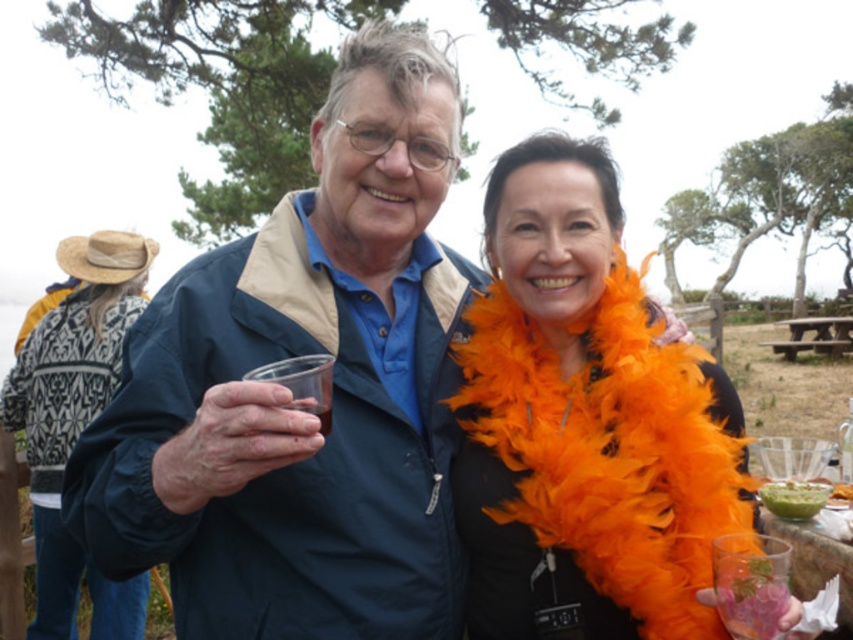
Question: Which point is farther to the camera?

Choices:
 (A) translucent plastic cup at center
 (B) white knitted sweater at upper left
 (C) orange feather boa at center

Answer: (B)

Question: Which object appears closest to the camera in this image?

Choices:
 (A) translucent plastic cup at center
 (B) blue fabric jacket at center

Answer: (B)

Question: Can you confirm if white knitted sweater at upper left is positioned to the right of wooden picnic table at center?

Choices:
 (A) yes
 (B) no

Answer: (B)

Question: Among these objects, which one is farthest from the camera?

Choices:
 (A) translucent plastic cup at center
 (B) blue fabric jacket at center
 (C) wooden picnic table at center

Answer: (C)

Question: Does white knitted sweater at upper left lie in front of translucent plastic cup at center?

Choices:
 (A) no
 (B) yes

Answer: (A)

Question: Is blue fabric jacket at center behind white knitted sweater at upper left?

Choices:
 (A) yes
 (B) no

Answer: (B)